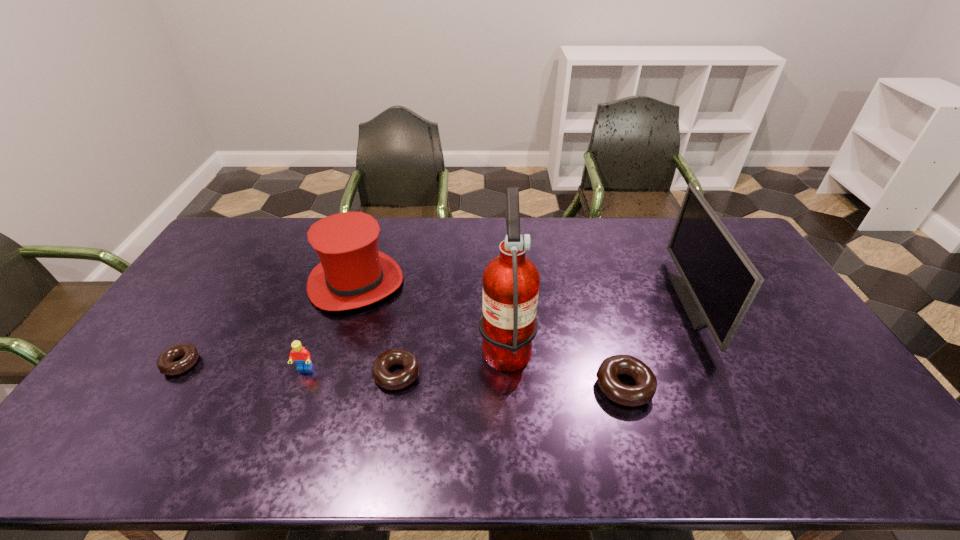
In order to click on vacant region between the leftmost doughnut and the second doughnut from left to right in this screenshot , I will do `click(289, 368)`.

Where is `free spot between the second doughnut from left to right and the second tallest object`? Image resolution: width=960 pixels, height=540 pixels. free spot between the second doughnut from left to right and the second tallest object is located at coordinates (546, 338).

Find the location of a particular element. unoccupied area between the fire extinguisher and the monitor is located at coordinates (601, 322).

Locate an element on the screen. The height and width of the screenshot is (540, 960). unoccupied area between the sixth shortest object and the second shortest object is located at coordinates (546, 338).

You are a GUI agent. You are given a task and a screenshot of the screen. Output one action in this format:
    pyautogui.click(x=<x>, y=<y>)
    Task: Click on the free space between the fourth tallest object and the second shortest doughnut
    The image size is (960, 540).
    Given the screenshot: What is the action you would take?
    pyautogui.click(x=350, y=372)

Locate an element on the screen. The height and width of the screenshot is (540, 960). free area in between the second shortest doughnut and the second object from right to left is located at coordinates coord(511,380).

I want to click on vacant point located between the fourth tallest object and the shortest doughnut, so click(x=243, y=366).

Where is `free spot between the second doughnut from right to left and the fourth tallest object`? free spot between the second doughnut from right to left and the fourth tallest object is located at coordinates (350, 372).

Identify which object is the third closest to the second tallest object. Please provide its 2D coordinates. Your answer should be formatted as a tuple, i.e. [(x, y)], where the tuple contains the x and y coordinates of a point satisfying the conditions above.

[(383, 377)]

Select which object is the second closest to the second object from right to left. Please provide its 2D coordinates. Your answer should be formatted as a tuple, i.e. [(x, y)], where the tuple contains the x and y coordinates of a point satisfying the conditions above.

[(719, 282)]